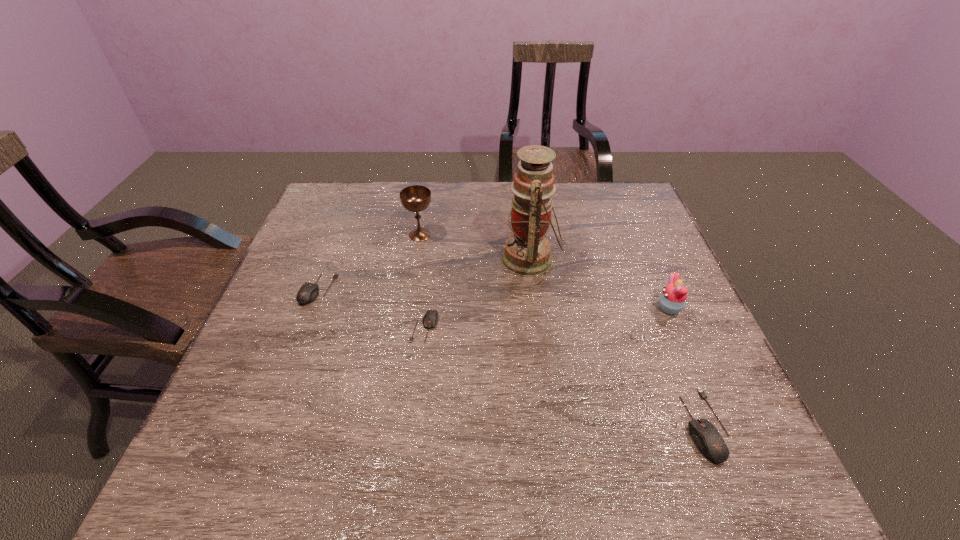
Find the location of `mouse that is at the right edge`. mouse that is at the right edge is located at coordinates (707, 438).

Image resolution: width=960 pixels, height=540 pixels. I want to click on cupcake present at the right edge, so click(x=672, y=300).

At what (x,y) coordinates should I click in order to perform the action: click on object positioned at the near right corner. Please return your answer as a coordinate pair (x, y). This screenshot has height=540, width=960. Looking at the image, I should click on (707, 438).

Locate an element on the screen. vacant space at the far edge is located at coordinates (509, 193).

I want to click on free location at the near edge of the desktop, so click(520, 397).

This screenshot has height=540, width=960. I want to click on vacant space at the left edge of the desktop, so click(336, 261).

In the image, there is a desktop. At what (x,y) coordinates should I click in order to perform the action: click on vacant space at the right edge. Please return your answer as a coordinate pair (x, y). The image size is (960, 540). Looking at the image, I should click on (677, 350).

In the image, there is a desktop. In order to click on vacant space at the far left corner in this screenshot , I will do pos(335,221).

Locate an element on the screen. The width and height of the screenshot is (960, 540). free space at the near right corner of the desktop is located at coordinates (684, 392).

At what (x,y) coordinates should I click in order to perform the action: click on empty space that is in between the shortest mouse and the third object from right to left. Please return your answer as a coordinate pair (x, y). Looking at the image, I should click on (477, 293).